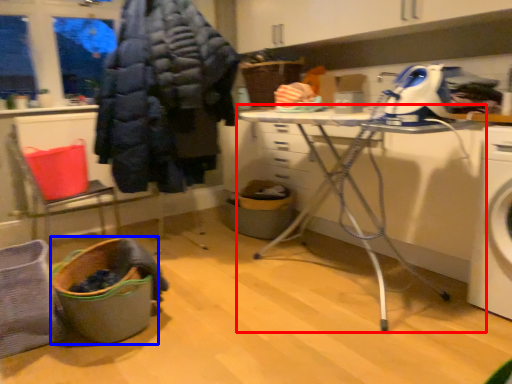
Question: Among these objects, which one is nearest to the camera, table (highlighted by a red box) or laundry basket (highlighted by a blue box)?

Choices:
 (A) table
 (B) laundry basket

Answer: (B)